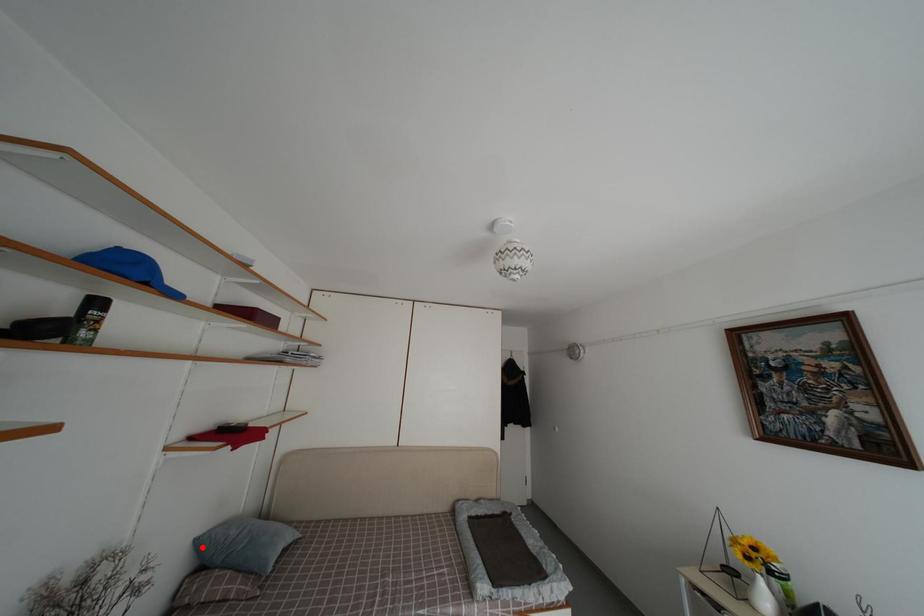
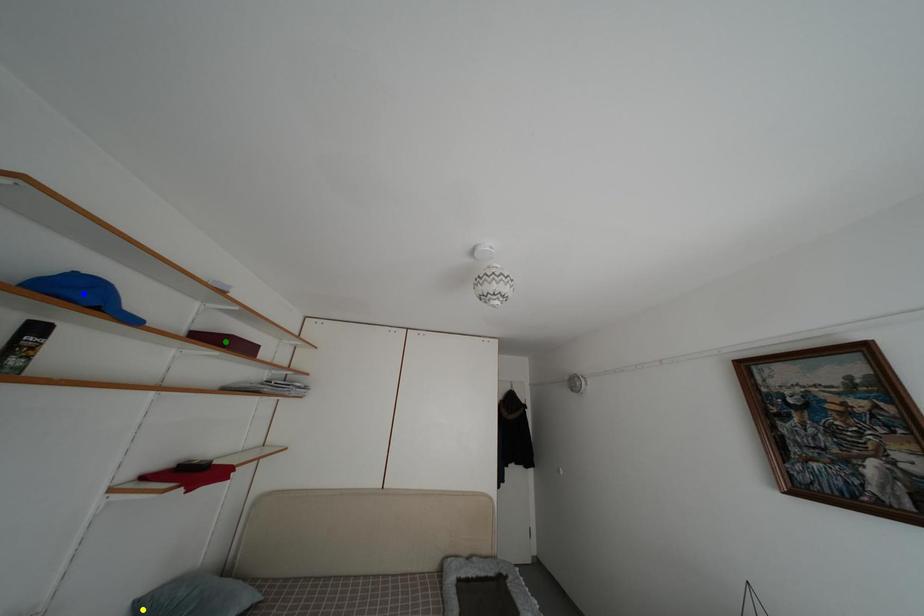
Question: I am providing you with two images of the same scene from different viewpoints. A red point is marked on the first image. You are given multiple points on the second image. In image 2, which mark is for the same physical point as the one in image 1?

Choices:
 (A) blue point
 (B) green point
 (C) yellow point

Answer: (C)